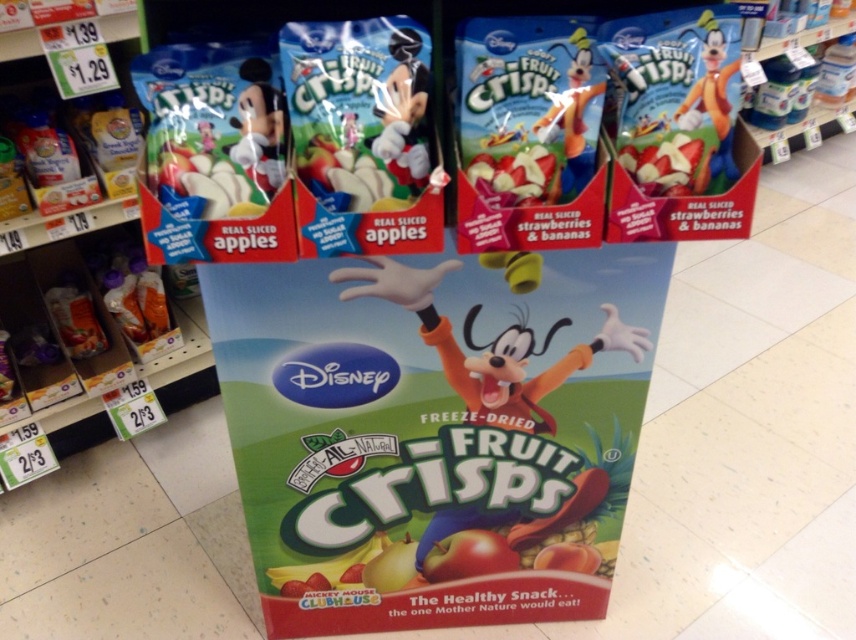
Question: Which point appears closest to the camera in this image?

Choices:
 (A) (275, 141)
 (B) (739, 29)

Answer: (A)

Question: Is matte plastic mickey mouse at upper center positioned in front of matte yellow plush toy at upper right?

Choices:
 (A) yes
 (B) no

Answer: (B)

Question: Can you confirm if white matte plush toy at center is bigger than matte plastic toy at center?

Choices:
 (A) yes
 (B) no

Answer: (B)

Question: Can you confirm if orange fabric goofy at center is positioned to the right of matte plastic toy at center?

Choices:
 (A) no
 (B) yes

Answer: (A)

Question: Estimate the real-world distances between objects in this image. Which object is closer to the matte yellow plush toy at upper right?

Choices:
 (A) orange fabric goofy at center
 (B) translucent plastic bag at lower left

Answer: (A)

Question: Considering the real-world distances, which object is farthest from the orange fabric goofy at center?

Choices:
 (A) matte plastic toy at center
 (B) translucent plastic bag at lower left
 (C) white matte plush toy at center
 (D) matte plastic mickey mouse at upper center

Answer: (B)